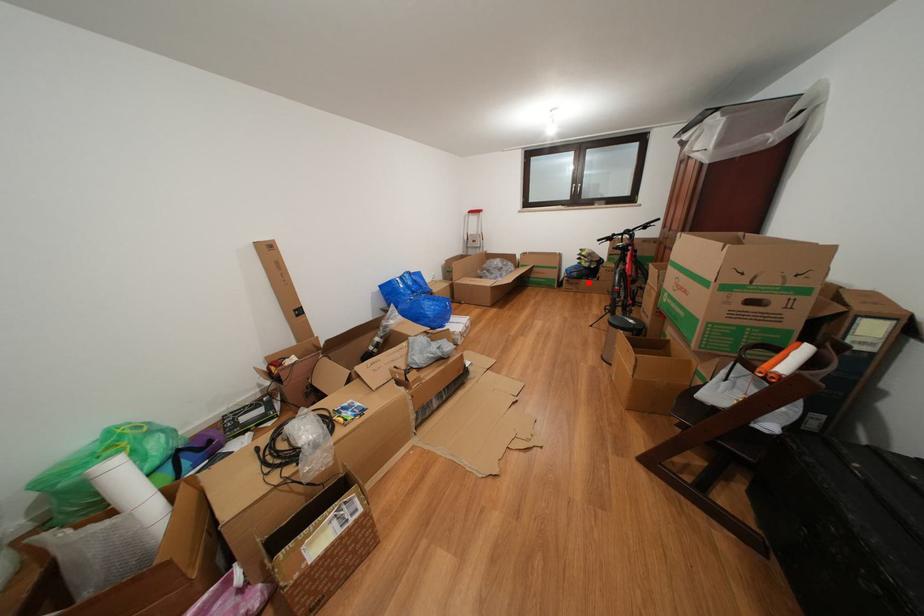
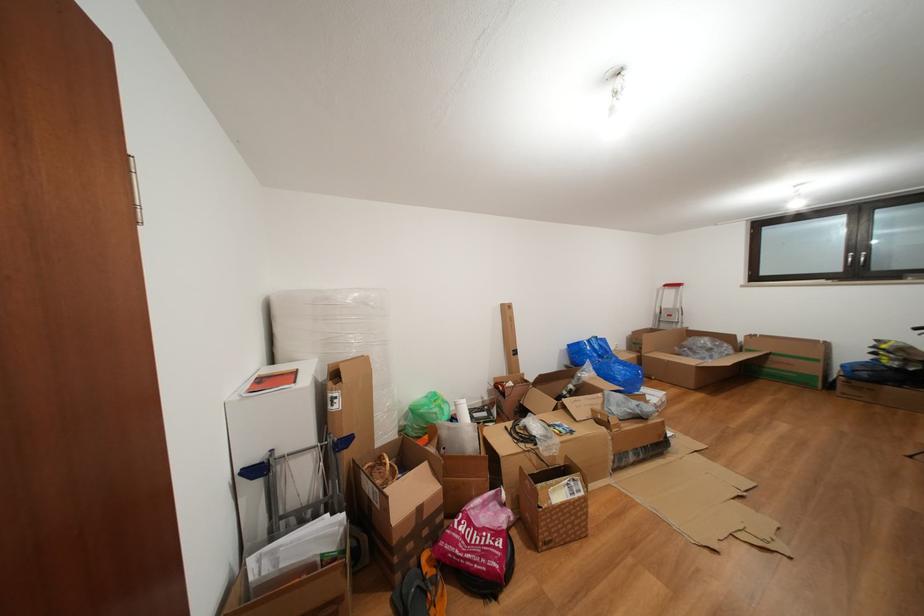
Where in the second image is the point corresponding to the highlighted location from the first image?

(886, 387)